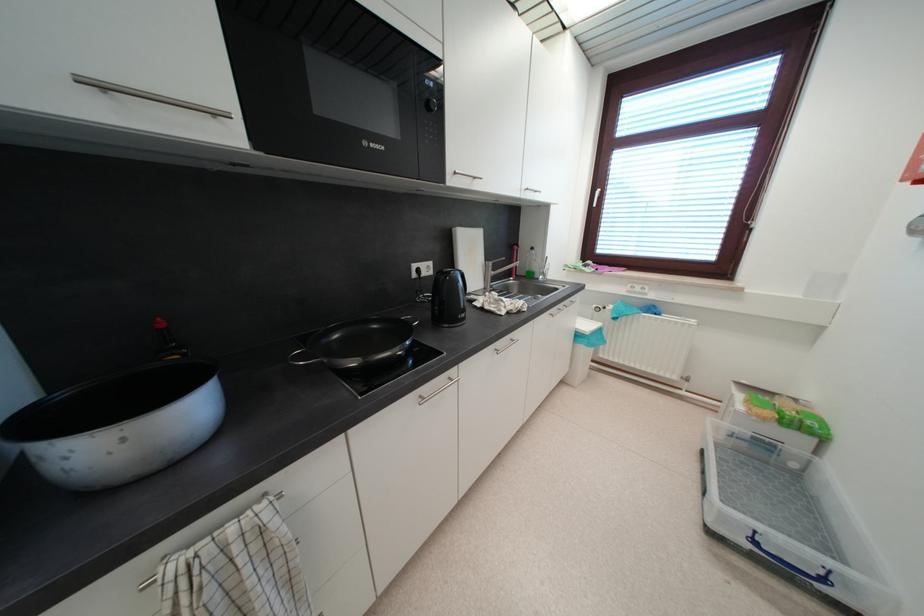
Describe the element at coordinates (433, 102) in the screenshot. I see `the microwave dial` at that location.